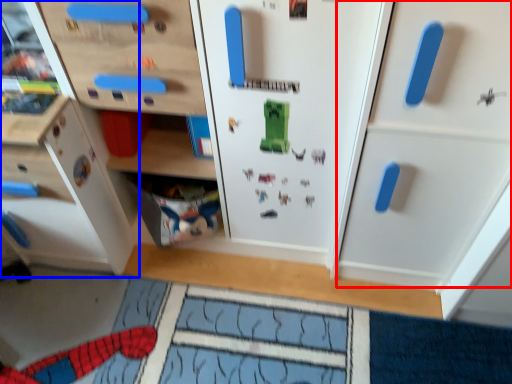
Question: Which of the following is the closest to the observer, cabinetry (highlighted by a red box) or cabinetry (highlighted by a blue box)?

Choices:
 (A) cabinetry
 (B) cabinetry

Answer: (A)